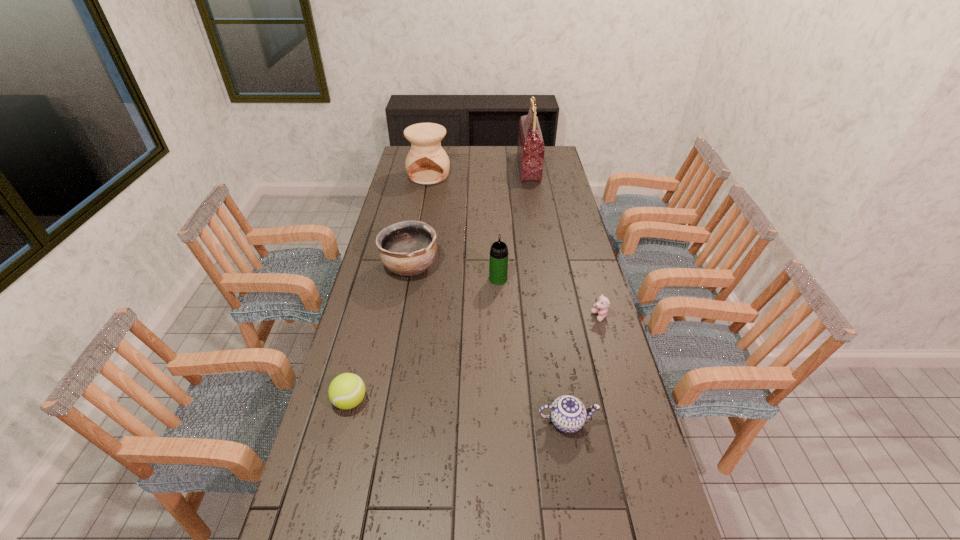
Identify the location of vacant space that is in between the tallest object and the teddy bear. The image size is (960, 540). (564, 242).

You are a GUI agent. You are given a task and a screenshot of the screen. Output one action in this format:
    pyautogui.click(x=<x>, y=<y>)
    Task: Click on the empty space between the chinaware and the tennis ball
    This screenshot has height=540, width=960.
    Given the screenshot: What is the action you would take?
    pyautogui.click(x=458, y=411)

What are the coordinates of `free space between the chinaware and the nearer pottery` in the screenshot? It's located at (489, 345).

Where is `vacant space in between the chinaware and the thermos bottle`? The width and height of the screenshot is (960, 540). vacant space in between the chinaware and the thermos bottle is located at coordinates (532, 350).

Identify the location of unoccupied position between the farther pottery and the tennis ball. This screenshot has width=960, height=540. click(x=390, y=288).

You are a GUI agent. You are given a task and a screenshot of the screen. Output one action in this format:
    pyautogui.click(x=<x>, y=<y>)
    Task: Click on the object that is the third nearest to the fifth farthest object
    This screenshot has width=960, height=540.
    Given the screenshot: What is the action you would take?
    pyautogui.click(x=408, y=248)

Locate an element on the screen. This screenshot has height=540, width=960. the sixth closest object relative to the chinaware is located at coordinates (427, 163).